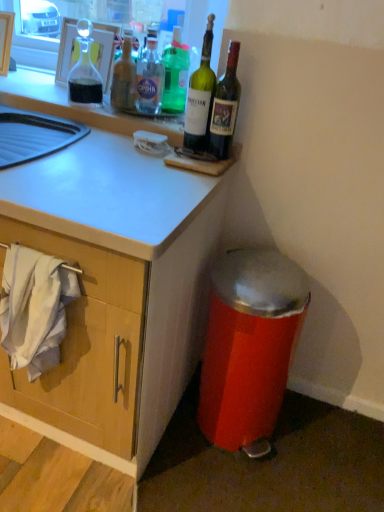
Where is `vacant space positioned to the left of translucent glass bottle at upper center, acting as the fifth bottle starting from the right`? The width and height of the screenshot is (384, 512). vacant space positioned to the left of translucent glass bottle at upper center, acting as the fifth bottle starting from the right is located at coordinates (82, 102).